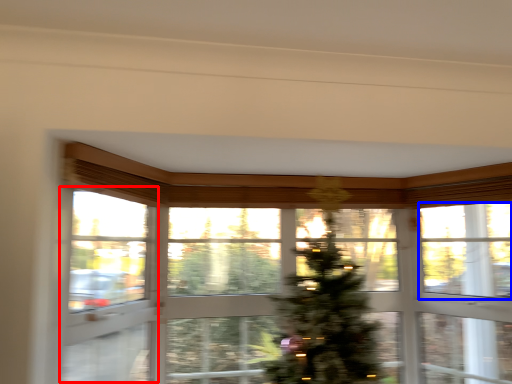
Question: Among these objects, which one is farthest to the camera, screen door (highlighted by a red box) or window screen (highlighted by a blue box)?

Choices:
 (A) screen door
 (B) window screen

Answer: (B)